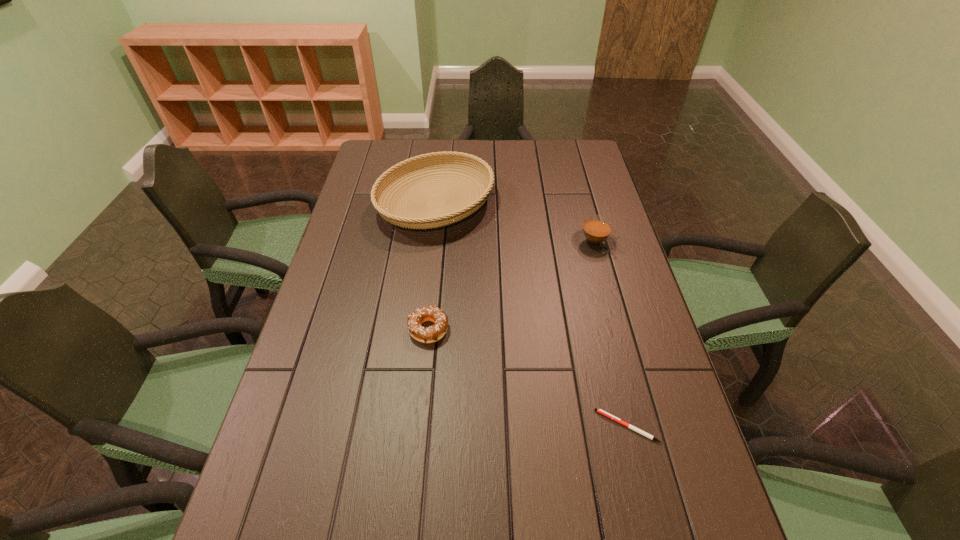
Image resolution: width=960 pixels, height=540 pixels. I want to click on free area in between the third shortest object and the third farthest object, so click(511, 286).

Where is `unoccupied area between the shortest object and the basket`? Image resolution: width=960 pixels, height=540 pixels. unoccupied area between the shortest object and the basket is located at coordinates (532, 315).

Where is `free space between the basket and the doughnut`? This screenshot has width=960, height=540. free space between the basket and the doughnut is located at coordinates [432, 266].

The height and width of the screenshot is (540, 960). What are the coordinates of `free space between the basket and the pen` in the screenshot? It's located at (532, 315).

Find the location of a particular element. The width and height of the screenshot is (960, 540). free area in between the basket and the second tallest object is located at coordinates (515, 222).

Identify the location of vacant space that is in between the pen and the basket. (532, 315).

This screenshot has width=960, height=540. What are the coordinates of `empty space between the third farthest object and the basket` in the screenshot? It's located at (432, 266).

Where is `vacant region between the basket and the cappuccino`? The image size is (960, 540). vacant region between the basket and the cappuccino is located at coordinates (515, 222).

This screenshot has height=540, width=960. Identify the location of empty location between the nearest object and the basket. (532, 315).

The height and width of the screenshot is (540, 960). I want to click on free space between the basket and the second nearest object, so click(x=432, y=266).